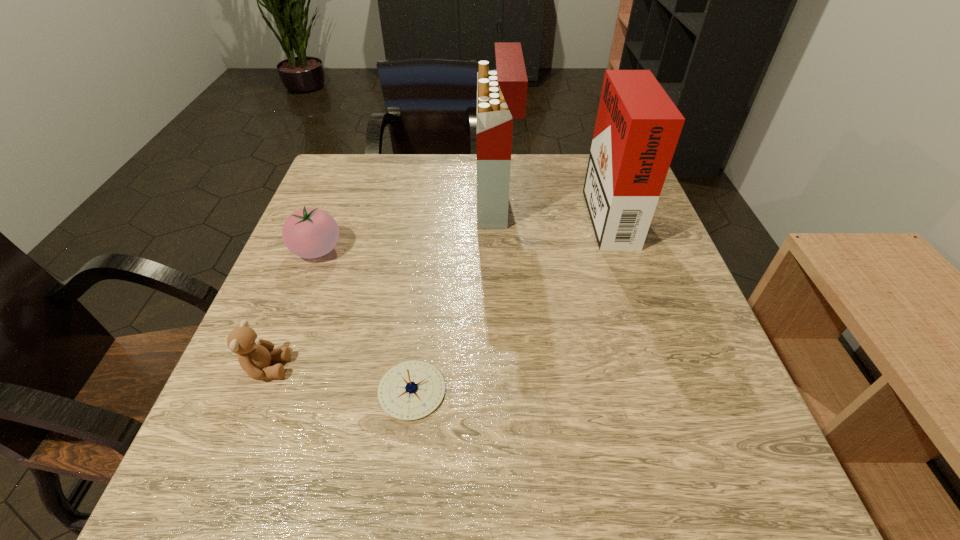
This screenshot has height=540, width=960. Identify the location of free spot between the teddy bear and the fourth object from left to right. (381, 285).

At what (x,y) coordinates should I click in order to perform the action: click on empty space between the third object from left to right and the teddy bear. Please return your answer as a coordinate pair (x, y). The height and width of the screenshot is (540, 960). Looking at the image, I should click on (340, 379).

This screenshot has height=540, width=960. I want to click on free spot between the fourth object from left to right and the teddy bear, so pyautogui.click(x=381, y=285).

At what (x,y) coordinates should I click in order to perform the action: click on free space between the tomato and the rightmost object. Please return your answer as a coordinate pair (x, y). The image size is (960, 540). Looking at the image, I should click on (462, 231).

The image size is (960, 540). I want to click on vacant area that lies between the shortest object and the rightmost object, so click(x=510, y=301).

Select which object appears as the third closest to the compass. Please provide its 2D coordinates. Your answer should be formatted as a tuple, i.e. [(x, y)], where the tuple contains the x and y coordinates of a point satisfying the conditions above.

[(501, 94)]

Identify the location of object that is the fourth closest to the right cigarette case. Image resolution: width=960 pixels, height=540 pixels. (254, 354).